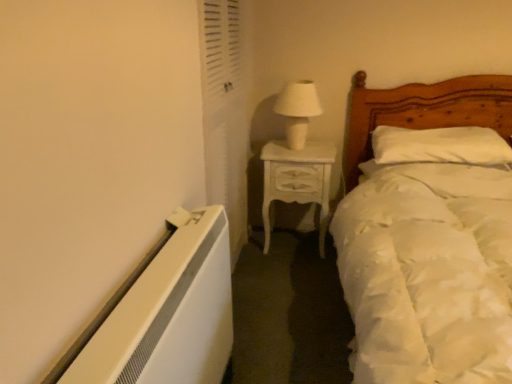
Question: Is white soft pillow at center bigger or smaller than white glossy nightstand at center?

Choices:
 (A) big
 (B) small

Answer: (B)

Question: Is white soft pillow at center spatially inside white glossy nightstand at center, or outside of it?

Choices:
 (A) outside
 (B) inside

Answer: (A)

Question: Which of these objects is positioned farthest from the white soft pillow at center?

Choices:
 (A) white textured screen door at upper left
 (B) white ceramic table lamp at upper center
 (C) white glossy nightstand at center
 (D) white satin bed at right

Answer: (A)

Question: Which object is positioned farthest from the white satin bed at right?

Choices:
 (A) white ceramic table lamp at upper center
 (B) white glossy nightstand at center
 (C) white textured screen door at upper left
 (D) white soft pillow at center

Answer: (C)